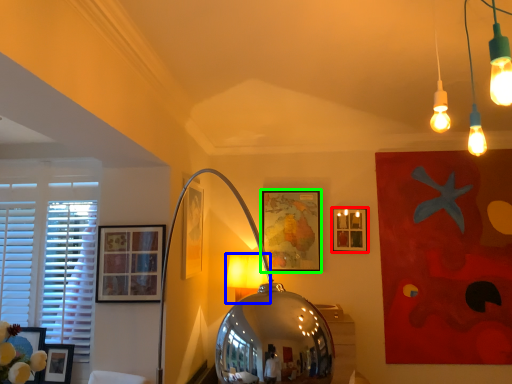
Question: Which object is positioned farthest from picture frame (highlighted by a red box)? Select from table lamp (highlighted by a blue box) and picture frame (highlighted by a green box).

Choices:
 (A) table lamp
 (B) picture frame

Answer: (A)